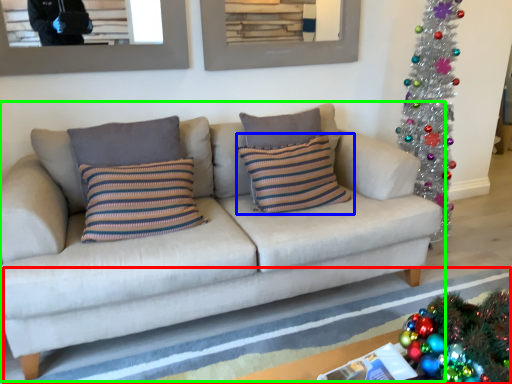
Question: Based on their relative distances, which object is nearer to strip (highlighted by a red box)? Choose from pillow (highlighted by a blue box) and studio couch (highlighted by a green box).

Choices:
 (A) pillow
 (B) studio couch

Answer: (B)